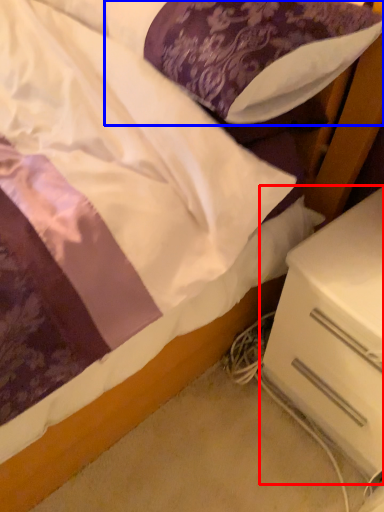
Question: Which of the following is the closest to the observer, nightstand (highlighted by a red box) or pillow (highlighted by a blue box)?

Choices:
 (A) nightstand
 (B) pillow

Answer: (B)